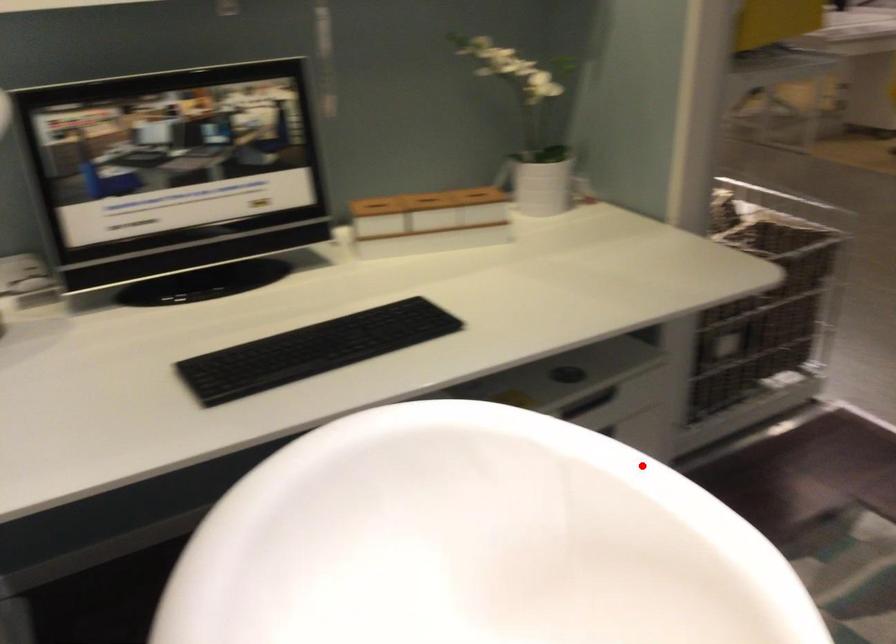
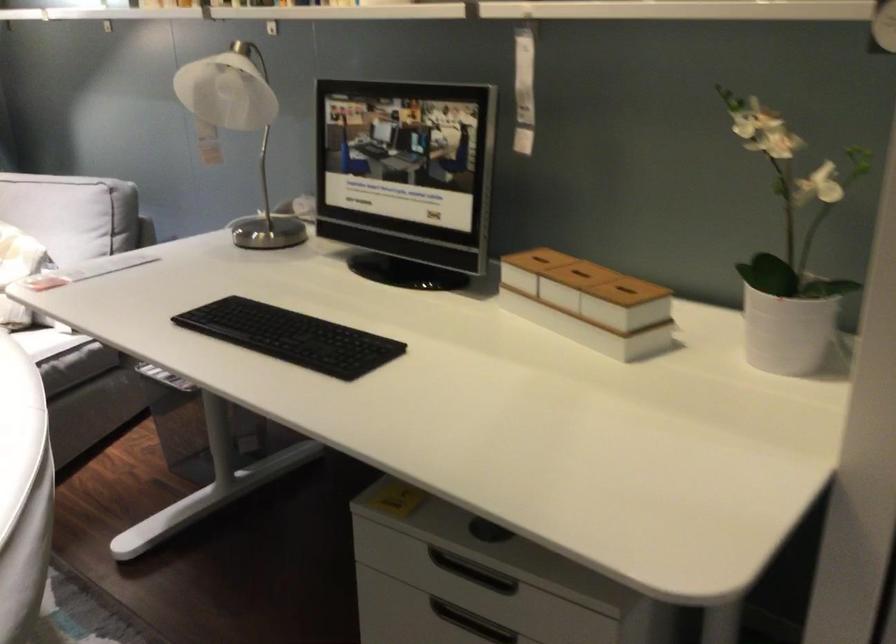
Locate, in the second image, the point that corresponds to the highlighted location in the first image.

(22, 489)